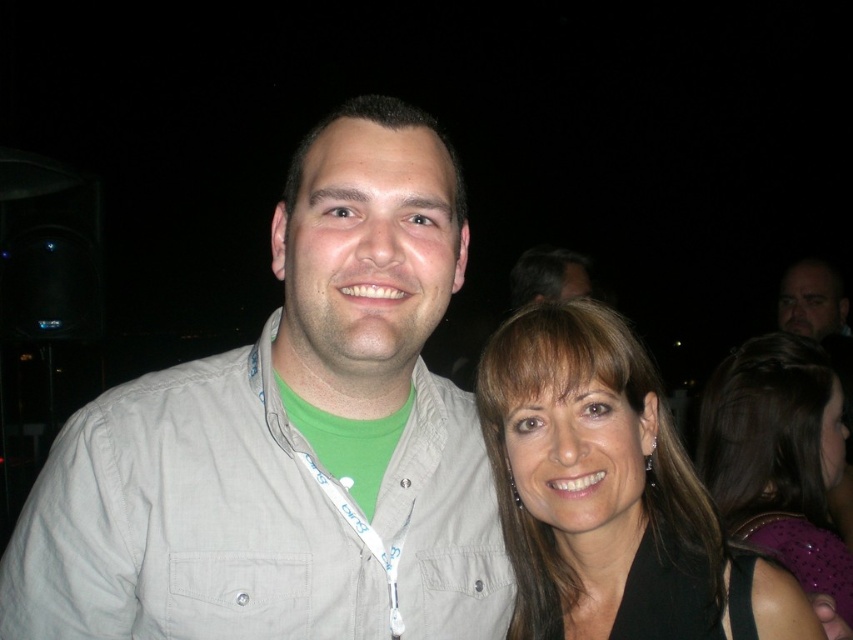
Question: Which object is farther from the camera taking this photo?

Choices:
 (A) black fabric hair at upper right
 (B) dark brown hair at upper center

Answer: (B)

Question: Which of the following is the closest to the observer?

Choices:
 (A) light gray shirt at center
 (B) dark brown hair at upper center
 (C) smooth brown hair at center

Answer: (A)

Question: Can you confirm if light gray shirt at center is positioned to the right of smooth brown hair at center?

Choices:
 (A) no
 (B) yes

Answer: (A)

Question: Observing the image, what is the correct spatial positioning of light gray shirt at center in reference to black fabric hair at upper right?

Choices:
 (A) below
 (B) above

Answer: (B)

Question: Can you confirm if light gray shirt at center is bigger than dark brown hair at upper center?

Choices:
 (A) yes
 (B) no

Answer: (A)

Question: Among these points, which one is nearest to the camera?

Choices:
 (A) (509, 301)
 (B) (321, 532)
 (C) (706, 472)

Answer: (B)